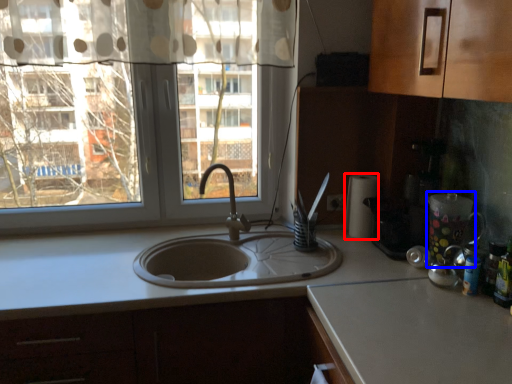
Question: Which of the following is the farthest to the observer, paper towel (highlighted by a red box) or appliance (highlighted by a blue box)?

Choices:
 (A) paper towel
 (B) appliance

Answer: (A)